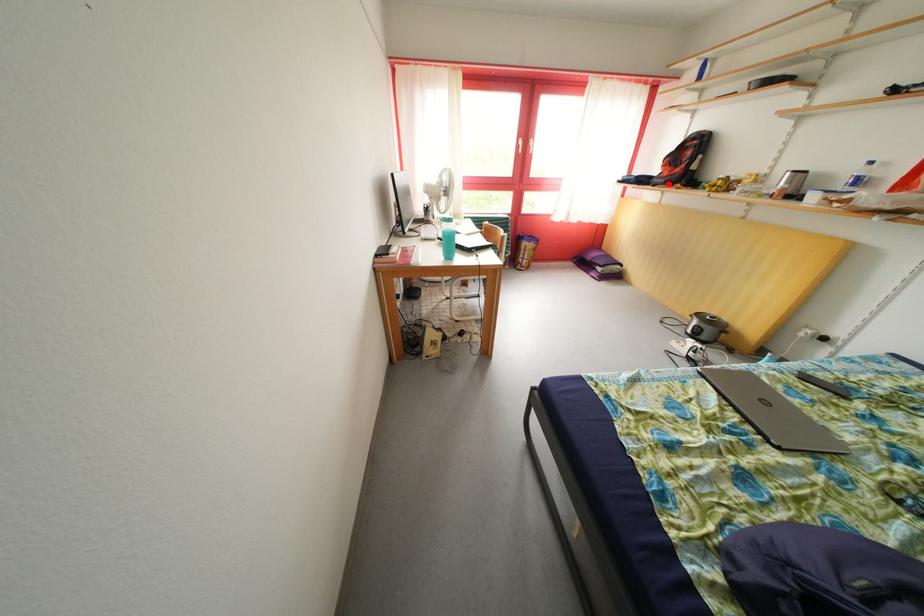
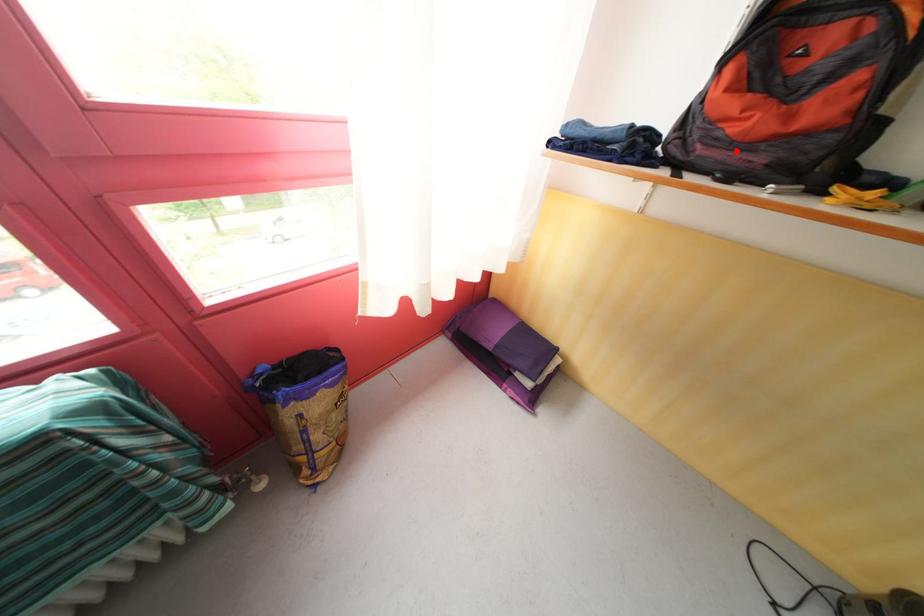
I am providing you with two images of the same scene from different viewpoints. A red point is marked on the first image and another point is marked on the second image. Is the marked point in image1 the same physical position as the marked point in image2?

Yes